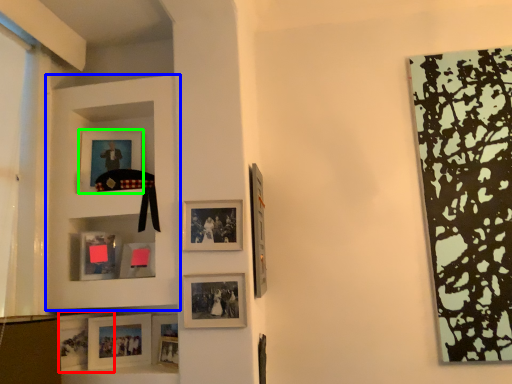
Question: Which is nearer to the picture frame (highlighted by a red box)? shelf (highlighted by a blue box) or picture frame (highlighted by a green box).

Choices:
 (A) shelf
 (B) picture frame

Answer: (A)